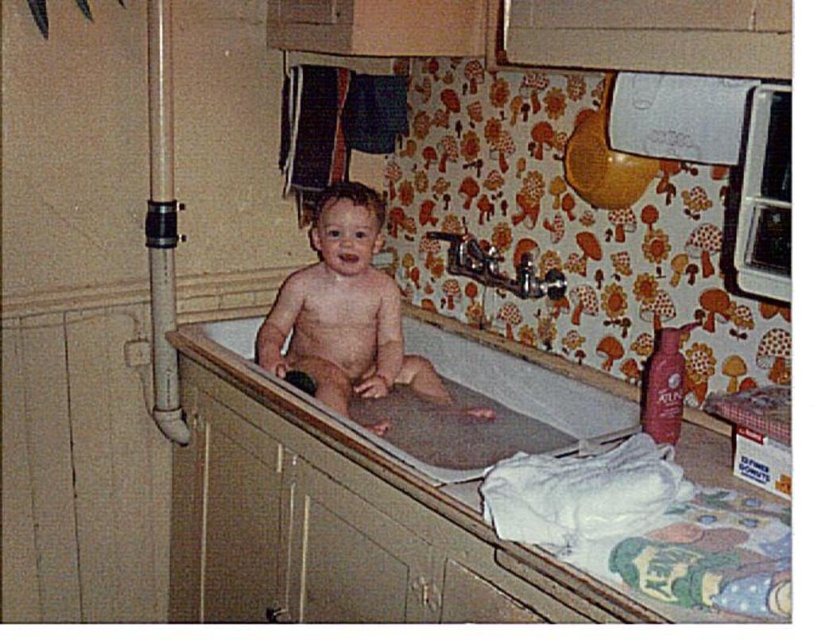
In the scene shown: Is smooth skin baby at center to the left of smooth plastic bathtub at center from the viewer's perspective?

Indeed, smooth skin baby at center is positioned on the left side of smooth plastic bathtub at center.

Describe the element at coordinates (344, 310) in the screenshot. The height and width of the screenshot is (640, 814). I see `smooth skin baby at center` at that location.

At what (x,y) coordinates should I click in order to perform the action: click on smooth skin baby at center. Please return your answer as a coordinate pair (x, y). Image resolution: width=814 pixels, height=640 pixels. Looking at the image, I should click on (344, 310).